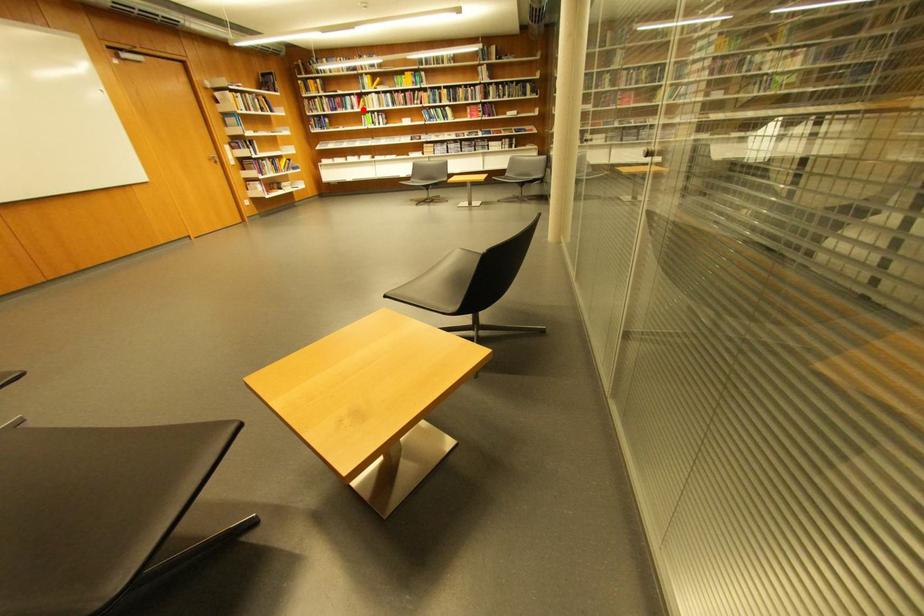
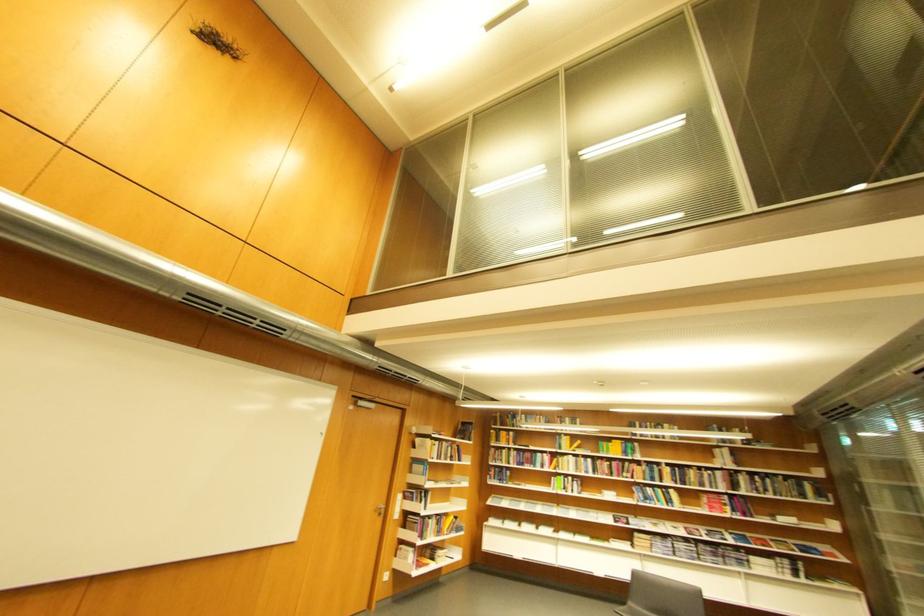
Question: I am providing you with two images of the same scene from different viewpoints. Image1 has a red point marked. In image2, the corresponding 3D location appears at what relative position? Reply with the corresponding letter.

Choices:
 (A) Closer
 (B) Farther

Answer: (B)